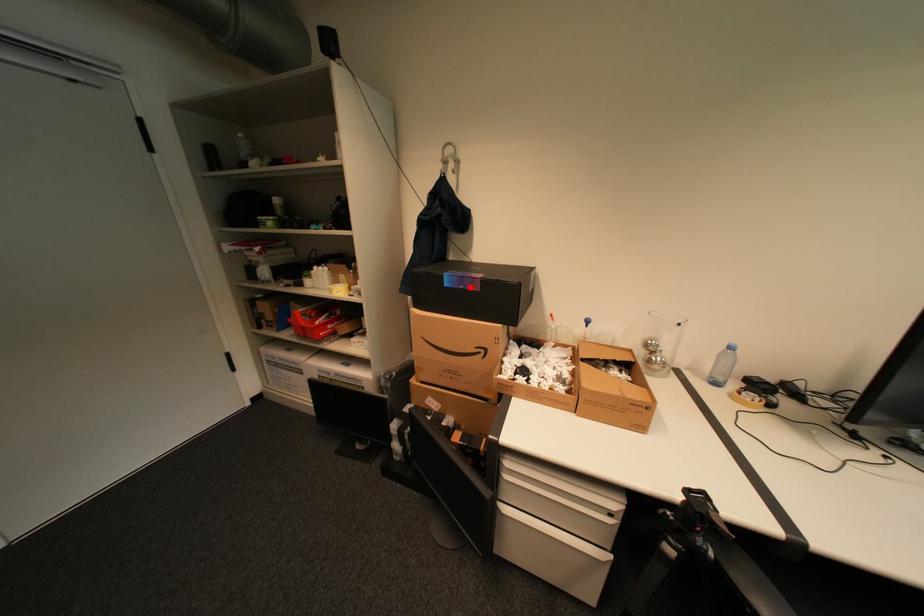
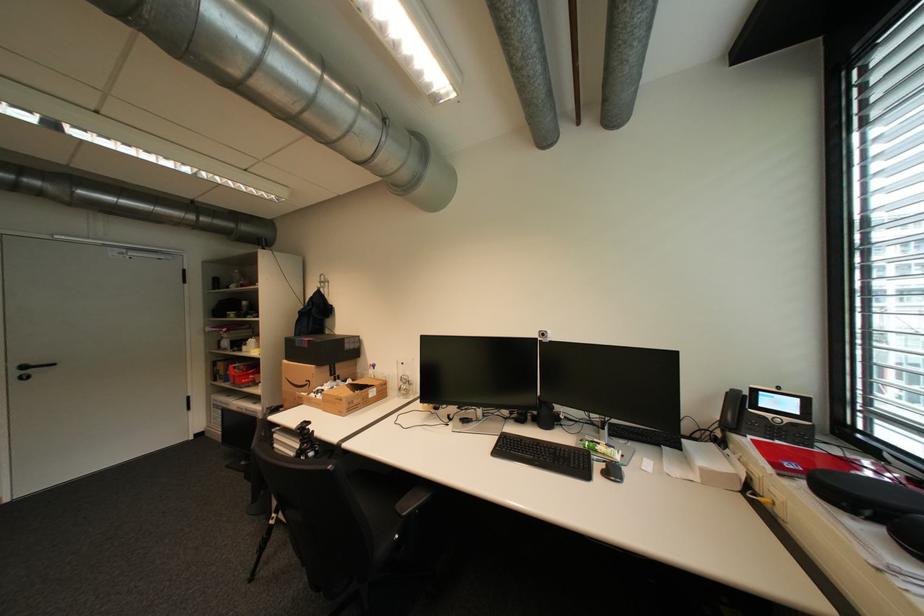
Find the pixel in the second image that matches the highlighted location in the first image.

(310, 346)